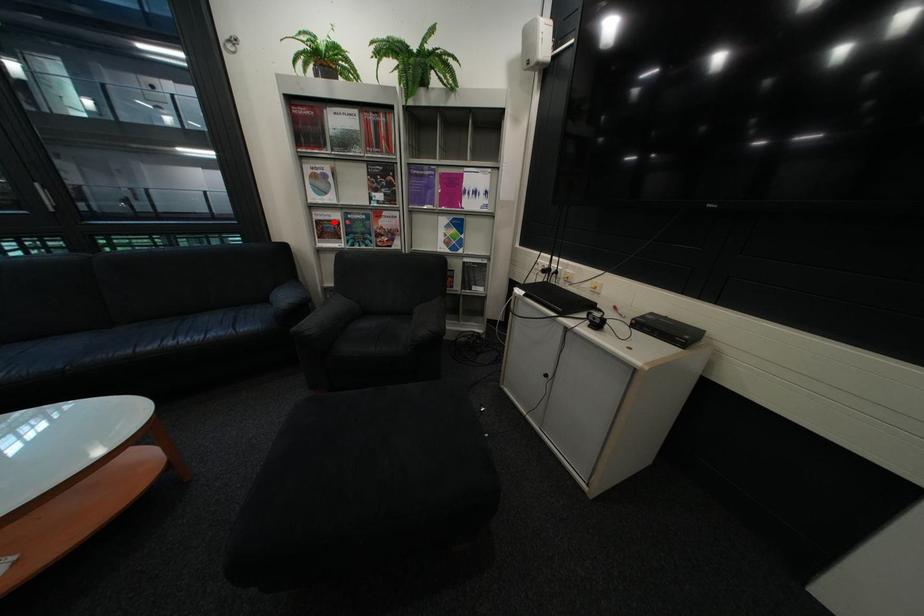
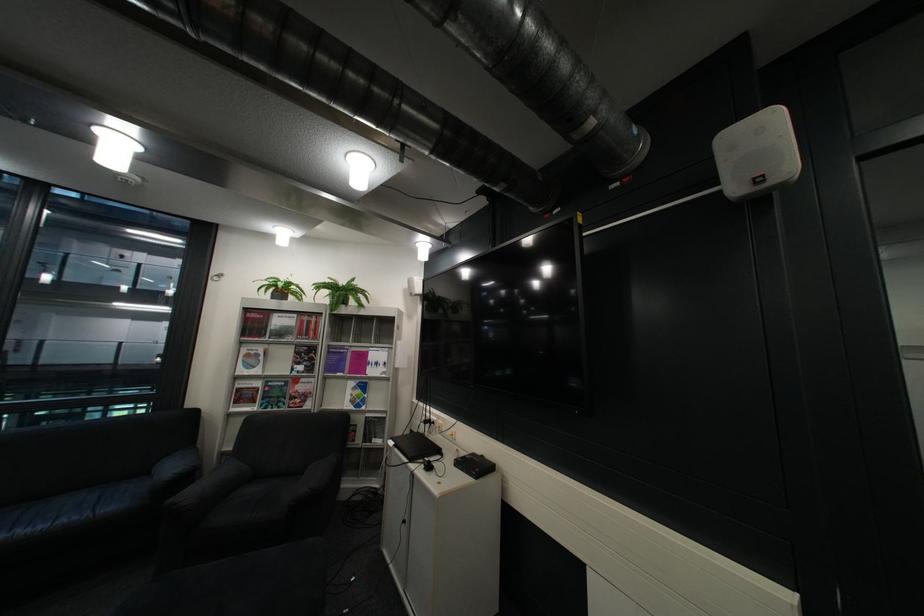
The point at the highlighted location is marked in the first image. Where is the corresponding point in the second image?

(254, 390)